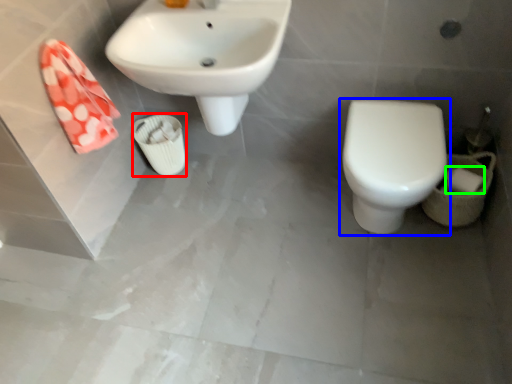
Question: Which object is the closest to the porcelain (highlighted by a red box)? Choose among these: toilet (highlighted by a blue box) or toilet paper (highlighted by a green box).

Choices:
 (A) toilet
 (B) toilet paper

Answer: (A)